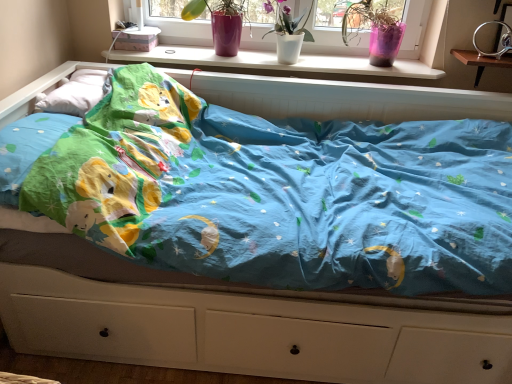
Locate an element on the screen. vacant area on top of white soft pillow at upper left (from a real-world perspective) is located at coordinates (89, 79).